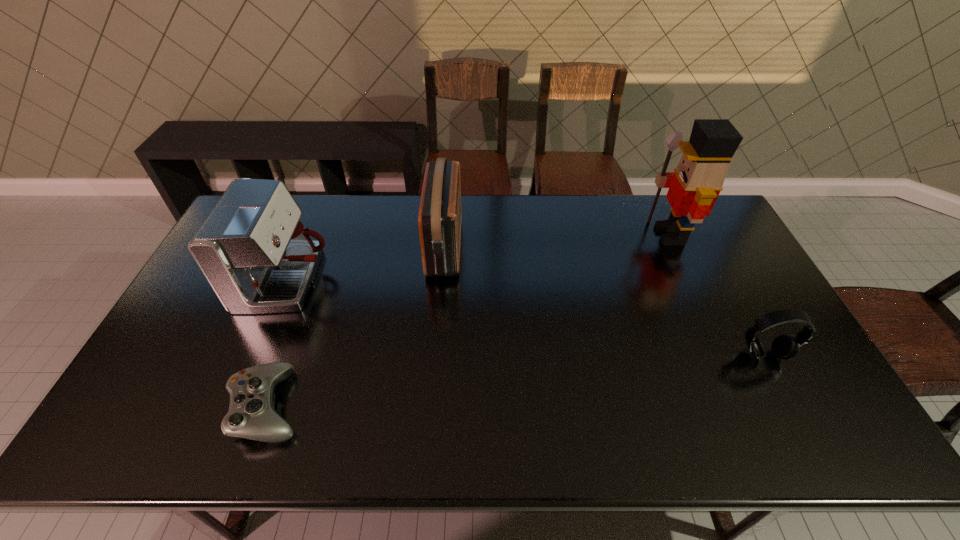
This screenshot has height=540, width=960. I want to click on object present at the far right corner, so click(x=694, y=187).

Locate an element on the screen. This screenshot has height=540, width=960. vacant space at the far edge of the desktop is located at coordinates (534, 220).

The image size is (960, 540). In the image, there is a desktop. In order to click on vacant space at the near edge in this screenshot , I will do `click(218, 448)`.

This screenshot has width=960, height=540. In the image, there is a desktop. In order to click on vacant region at the left edge in this screenshot , I will do `click(194, 315)`.

Where is `free space at the right edge of the desktop`? The width and height of the screenshot is (960, 540). free space at the right edge of the desktop is located at coordinates (699, 259).

I want to click on free space between the tallest object and the control, so click(x=468, y=320).

Locate an element on the screen. Image resolution: width=960 pixels, height=540 pixels. free spot between the control and the third object from left to right is located at coordinates (356, 326).

Where is `vacant space that's between the fourth tallest object and the control`? vacant space that's between the fourth tallest object and the control is located at coordinates (516, 380).

Locate an element on the screen. This screenshot has width=960, height=540. free space between the tallest object and the coffee maker is located at coordinates (479, 258).

Identify the location of empty location between the coffee maker and the fourth tallest object. The image size is (960, 540). (526, 318).